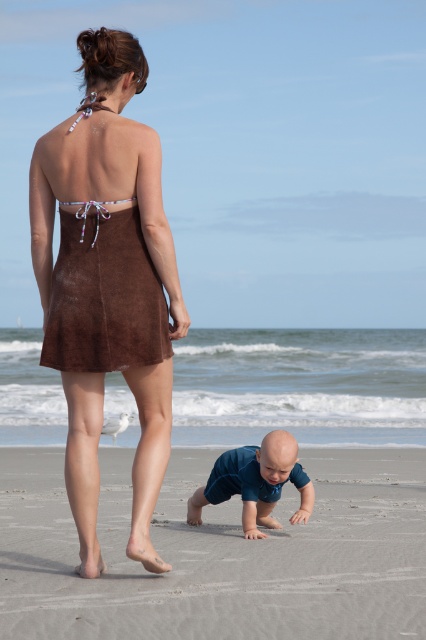
Question: Which object is positioned farthest from the blue fabric baby at lower center?

Choices:
 (A) brown suede dress at center
 (B) smooth sand at lower center

Answer: (A)

Question: Among these objects, which one is farthest from the camera?

Choices:
 (A) smooth sand at lower center
 (B) brown suede dress at center
 (C) blue fabric baby at lower center

Answer: (C)

Question: Can you confirm if smooth sand at lower center is wider than brown suede dress at center?

Choices:
 (A) no
 (B) yes

Answer: (B)

Question: Does brown suede dress at center appear on the right side of blue fabric baby at lower center?

Choices:
 (A) yes
 (B) no

Answer: (B)

Question: Based on their relative distances, which object is farther from the brown suede dress at center?

Choices:
 (A) blue fabric baby at lower center
 (B) smooth sand at lower center

Answer: (B)

Question: Does smooth sand at lower center appear over brown suede dress at center?

Choices:
 (A) no
 (B) yes

Answer: (A)